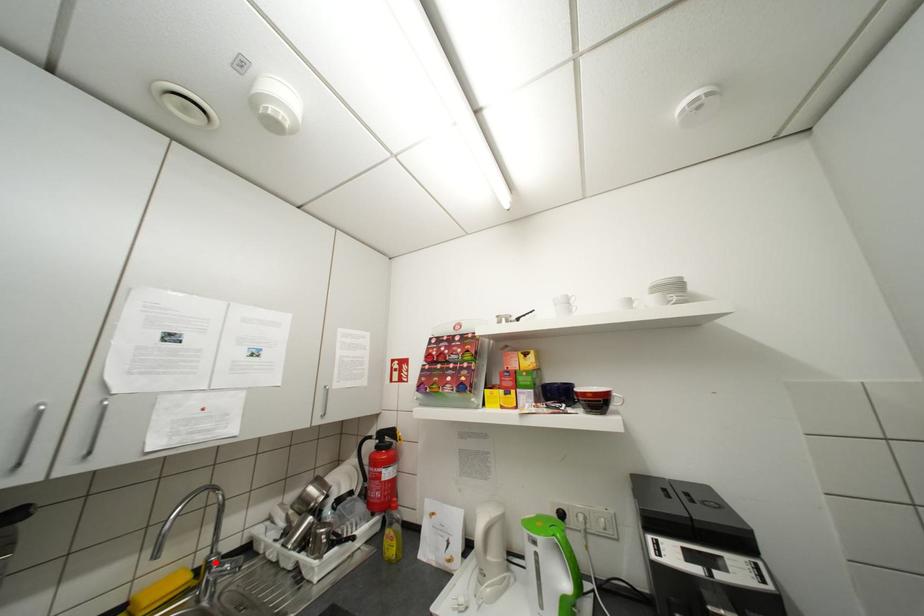
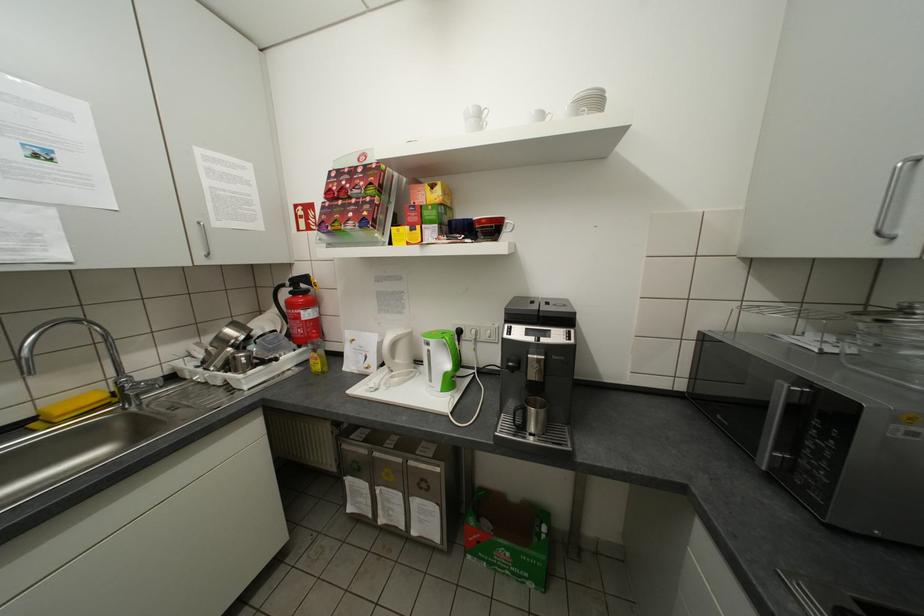
In the second image, find the point that corresponds to the highlighted location in the first image.

(126, 383)